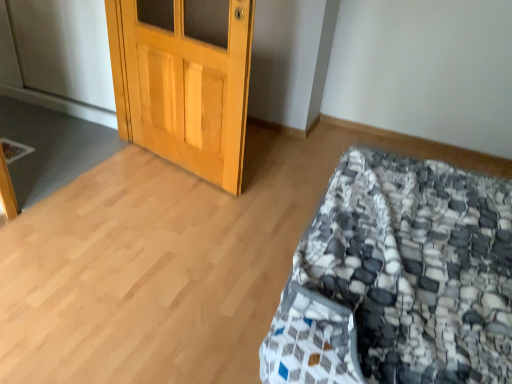
The width and height of the screenshot is (512, 384). I want to click on vacant space positioned to the left of textured gray and white quilt at lower right, so click(130, 263).